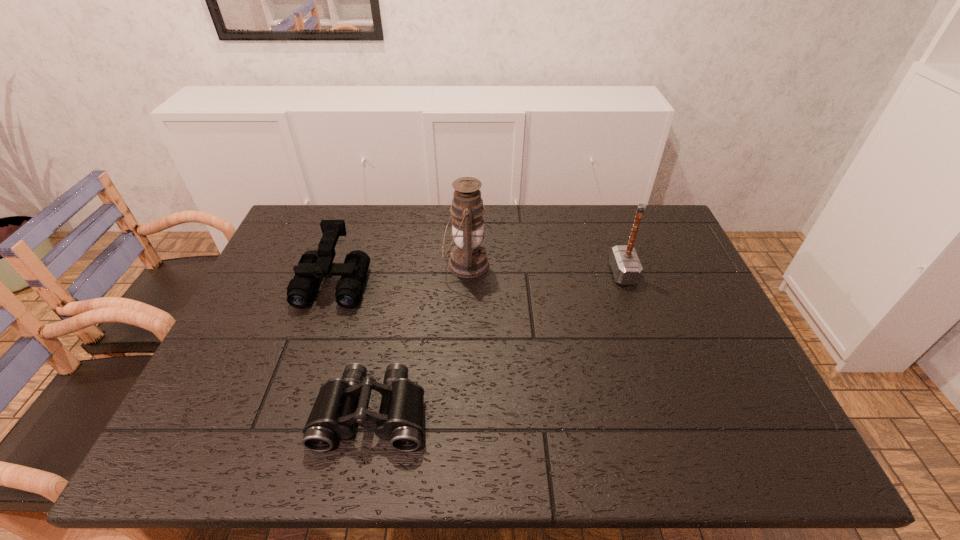
Identify the location of vacant space located 0.250m on the striking surface of the rightmost object. The image size is (960, 540). (528, 273).

The width and height of the screenshot is (960, 540). Find the location of `free spot located 0.100m on the striking surface of the rightmost object`. free spot located 0.100m on the striking surface of the rightmost object is located at coordinates (578, 273).

This screenshot has width=960, height=540. What are the coordinates of `vacant position located on the front lenses of the farther binoculars` in the screenshot? It's located at (292, 403).

I want to click on object located in the far edge section of the desktop, so click(x=468, y=259).

I want to click on object that is at the near edge, so click(340, 403).

Where is `object at the left edge`? object at the left edge is located at coordinates (313, 265).

This screenshot has height=540, width=960. In the image, there is a desktop. What are the coordinates of `free space at the far edge` in the screenshot? It's located at (613, 210).

This screenshot has width=960, height=540. I want to click on vacant space at the near edge of the desktop, so click(441, 449).

Identify the location of free space at the left edge of the desktop. (298, 313).

Image resolution: width=960 pixels, height=540 pixels. What are the coordinates of `vacant space at the right edge` in the screenshot? It's located at (706, 378).